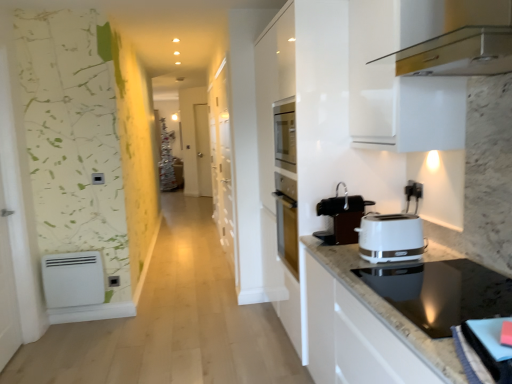
Locate an element on the screen. black plastic electric outlet at lower left, placed as the 1th electric outlet when sorted from back to front is located at coordinates (114, 281).

How much space does black plastic electric outlet at lower left, the first electric outlet when ordered from left to right, occupy vertically?

The height of black plastic electric outlet at lower left, the first electric outlet when ordered from left to right, is 3.56 inches.

I want to click on white matte heater at lower left, so coord(73,279).

You are a GUI agent. You are given a task and a screenshot of the screen. Output one action in this format:
    pyautogui.click(x=<x>, y=<y>)
    Task: Click on the white glossy toaster at right
    
    Given the screenshot: What is the action you would take?
    pyautogui.click(x=391, y=238)

What is the approximate width of metallic gold range hood at upper right, the first home appliance positioned from the top?

metallic gold range hood at upper right, the first home appliance positioned from the top, is 18.78 inches wide.

This screenshot has height=384, width=512. I want to click on black plastic electric outlet at lower left, the 2th electric outlet viewed from the right, so click(x=114, y=281).

Which object is further away from the camera, white glossy cabinet at center or white matte heater at lower left?

Positioned behind is white glossy cabinet at center.

Consider the image. Is white glossy cabinet at center placed right next to white matte heater at lower left?

No, white glossy cabinet at center is not making contact with white matte heater at lower left.

Which is closer to the camera, (218, 86) or (67, 291)?

Point (218, 86) is positioned farther from the camera compared to point (67, 291).

Is black glass cooktop at lower right, acting as the first home appliance starting from the bottom, at the back of black plastic coffee machine at center?

No.

From the image's perspective, is black plastic coffee machine at center under black glass cooktop at lower right, the second home appliance when ordered from top to bottom?

No.

In the scene shown: Which of these two, black plastic coffee machine at center or black glass cooktop at lower right, acting as the first home appliance starting from the bottom, is bigger?

With larger size is black glass cooktop at lower right, acting as the first home appliance starting from the bottom.

Looking at their sizes, would you say black plastic coffee machine at center is wider or thinner than black glass cooktop at lower right, acting as the first home appliance starting from the bottom?

Considering their sizes, black plastic coffee machine at center looks slimmer than black glass cooktop at lower right, acting as the first home appliance starting from the bottom.

Is point (418, 189) in front of point (344, 213)?

That is False.

From a real-world perspective, is black plastic electric outlet at upper right, the 1th electric outlet when ordered from right to left, below black plastic coffee machine at center?

No, from a real-world perspective, black plastic electric outlet at upper right, the 1th electric outlet when ordered from right to left, is not below black plastic coffee machine at center.

What's the angular difference between black plastic electric outlet at upper right, arranged as the second electric outlet when ordered from the bottom, and black plastic coffee machine at center's facing directions?

The angular difference between black plastic electric outlet at upper right, arranged as the second electric outlet when ordered from the bottom, and black plastic coffee machine at center is 3 degrees.

Considering the sizes of objects black plastic electric outlet at upper right, which is counted as the first electric outlet, starting from the front, and black plastic coffee machine at center in the image provided, who is bigger, black plastic electric outlet at upper right, which is counted as the first electric outlet, starting from the front, or black plastic coffee machine at center?

With larger size is black plastic coffee machine at center.

Considering the relative sizes of black plastic electric outlet at upper right, the second electric outlet in the back-to-front sequence, and white matte heater at lower left in the image provided, is black plastic electric outlet at upper right, the second electric outlet in the back-to-front sequence, shorter than white matte heater at lower left?

Indeed, black plastic electric outlet at upper right, the second electric outlet in the back-to-front sequence, has a lesser height compared to white matte heater at lower left.

Would you say black plastic electric outlet at upper right, positioned as the first electric outlet in top-to-bottom order, is to the left or to the right of white matte heater at lower left in the picture?

Clearly, black plastic electric outlet at upper right, positioned as the first electric outlet in top-to-bottom order, is on the right of white matte heater at lower left in the image.

Between black plastic electric outlet at upper right, the second electric outlet in the back-to-front sequence, and white matte heater at lower left, which one has smaller size?

black plastic electric outlet at upper right, the second electric outlet in the back-to-front sequence.

From a real-world perspective, does black plastic electric outlet at upper right, the second electric outlet in the back-to-front sequence, sit lower than white matte heater at lower left?

No, from a real-world perspective, black plastic electric outlet at upper right, the second electric outlet in the back-to-front sequence, is not below white matte heater at lower left.

From a real-world perspective, which is physically above, metallic gold range hood at upper right, the first home appliance positioned from the top, or black plastic electric outlet at lower left, placed as the 2th electric outlet when sorted from front to back?

metallic gold range hood at upper right, the first home appliance positioned from the top, is physically above.

What's the angular difference between metallic gold range hood at upper right, the first home appliance positioned from the top, and black plastic electric outlet at lower left, the second electric outlet positioned from the top,'s facing directions?

90.3 degrees separate the facing orientations of metallic gold range hood at upper right, the first home appliance positioned from the top, and black plastic electric outlet at lower left, the second electric outlet positioned from the top.

Based on the photo, between metallic gold range hood at upper right, the first home appliance positioned from the top, and black plastic electric outlet at lower left, the 2th electric outlet viewed from the right, which one has less height?

black plastic electric outlet at lower left, the 2th electric outlet viewed from the right.

Looking at their sizes, would you say metallic gold range hood at upper right, the second home appliance in the bottom-to-top sequence, is wider or thinner than black plastic electric outlet at lower left, the 2th electric outlet viewed from the right?

Considering their sizes, metallic gold range hood at upper right, the second home appliance in the bottom-to-top sequence, looks broader than black plastic electric outlet at lower left, the 2th electric outlet viewed from the right.

From a real-world perspective, is black glass cooktop at lower right, acting as the first home appliance starting from the bottom, beneath metallic gold range hood at upper right, the first home appliance positioned from the top?

Yes, from a real-world perspective, black glass cooktop at lower right, acting as the first home appliance starting from the bottom, is under metallic gold range hood at upper right, the first home appliance positioned from the top.

How much distance is there between black glass cooktop at lower right, acting as the first home appliance starting from the bottom, and metallic gold range hood at upper right, the second home appliance in the bottom-to-top sequence?

black glass cooktop at lower right, acting as the first home appliance starting from the bottom, and metallic gold range hood at upper right, the second home appliance in the bottom-to-top sequence, are 89.03 centimeters apart from each other.

Which object is wider, black glass cooktop at lower right, acting as the first home appliance starting from the bottom, or metallic gold range hood at upper right, the second home appliance in the bottom-to-top sequence?

Wider between the two is black glass cooktop at lower right, acting as the first home appliance starting from the bottom.

Does black glass cooktop at lower right, acting as the first home appliance starting from the bottom, have a larger size compared to metallic gold range hood at upper right, the first home appliance positioned from the top?

Actually, black glass cooktop at lower right, acting as the first home appliance starting from the bottom, might be smaller than metallic gold range hood at upper right, the first home appliance positioned from the top.

Looking at this image, who is taller, metallic gold range hood at upper right, the second home appliance in the bottom-to-top sequence, or black glass cooktop at lower right, the second home appliance when ordered from top to bottom?

Standing taller between the two is metallic gold range hood at upper right, the second home appliance in the bottom-to-top sequence.

Does metallic gold range hood at upper right, the second home appliance in the bottom-to-top sequence, lie behind black glass cooktop at lower right, the second home appliance when ordered from top to bottom?

No, it is in front of black glass cooktop at lower right, the second home appliance when ordered from top to bottom.

From the image's perspective, which one is positioned higher, metallic gold range hood at upper right, the first home appliance positioned from the top, or black glass cooktop at lower right, acting as the first home appliance starting from the bottom?

metallic gold range hood at upper right, the first home appliance positioned from the top, appears higher in the image.

The image size is (512, 384). In order to click on cabinetry that is behind the white matte heater at lower left in this screenshot , I will do `click(222, 161)`.

Where is `home appliance below the black plastic coffee machine at center (from the image's perspective)`? This screenshot has height=384, width=512. home appliance below the black plastic coffee machine at center (from the image's perspective) is located at coordinates (441, 292).

In the scene shown: Which object lies nearer to the anchor point white glossy cabinet at center, white glossy toaster at right or metallic gold range hood at upper right, the first home appliance positioned from the top?

metallic gold range hood at upper right, the first home appliance positioned from the top, is positioned closer to the anchor white glossy cabinet at center.

Looking at the image, which one is located further to white glossy cabinet at center, black plastic electric outlet at upper right, marked as the 2th electric outlet in a left-to-right arrangement, or white matte heater at lower left?

The object further to white glossy cabinet at center is black plastic electric outlet at upper right, marked as the 2th electric outlet in a left-to-right arrangement.

In the scene shown: Based on their spatial positions, is white matte heater at lower left or white glossy cabinet at center further from black plastic electric outlet at lower left, the first electric outlet when ordered from left to right?

white glossy cabinet at center is further to black plastic electric outlet at lower left, the first electric outlet when ordered from left to right.

From the picture: Estimate the real-world distances between objects in this image. Which object is further from white glossy toaster at right, black plastic electric outlet at upper right, positioned as the first electric outlet in top-to-bottom order, or metallic gold range hood at upper right, the first home appliance positioned from the top?

metallic gold range hood at upper right, the first home appliance positioned from the top, is positioned further to the anchor white glossy toaster at right.

When comparing their distances from white glossy toaster at right, does white matte heater at lower left or black glass cooktop at lower right, acting as the first home appliance starting from the bottom, seem further?

white matte heater at lower left is further to white glossy toaster at right.

Based on their spatial positions, is metallic gold range hood at upper right, the first home appliance positioned from the top, or black plastic electric outlet at upper right, arranged as the second electric outlet when ordered from the bottom, further from white matte heater at lower left?

Based on the image, metallic gold range hood at upper right, the first home appliance positioned from the top, appears to be further to white matte heater at lower left.

Based on their spatial positions, is black plastic coffee machine at center or white matte heater at lower left further from black glass cooktop at lower right, acting as the first home appliance starting from the bottom?

white matte heater at lower left is positioned further to the anchor black glass cooktop at lower right, acting as the first home appliance starting from the bottom.

Estimate the real-world distances between objects in this image. Which object is closer to black glass cooktop at lower right, acting as the first home appliance starting from the bottom, white glossy toaster at right or black plastic electric outlet at lower left, the second electric outlet positioned from the top?

white glossy toaster at right.

This screenshot has width=512, height=384. In order to click on kitchen appliance between metallic gold range hood at upper right, the second home appliance in the bottom-to-top sequence, and black plastic electric outlet at upper right, positioned as the first electric outlet in top-to-bottom order, along the z-axis in this screenshot , I will do `click(342, 217)`.

Find the location of a particular element. The image size is (512, 384). toaster between black glass cooktop at lower right, acting as the first home appliance starting from the bottom, and white glossy cabinet at center, along the z-axis is located at coordinates (391, 238).

In order to click on toaster located between metallic gold range hood at upper right, the second home appliance in the bottom-to-top sequence, and white glossy cabinet at center in the depth direction in this screenshot , I will do `click(391, 238)`.

This screenshot has width=512, height=384. What are the coordinates of `home appliance between metallic gold range hood at upper right, the first home appliance positioned from the top, and black plastic electric outlet at upper right, arranged as the second electric outlet when ordered from the bottom, from front to back` in the screenshot? It's located at (441, 292).